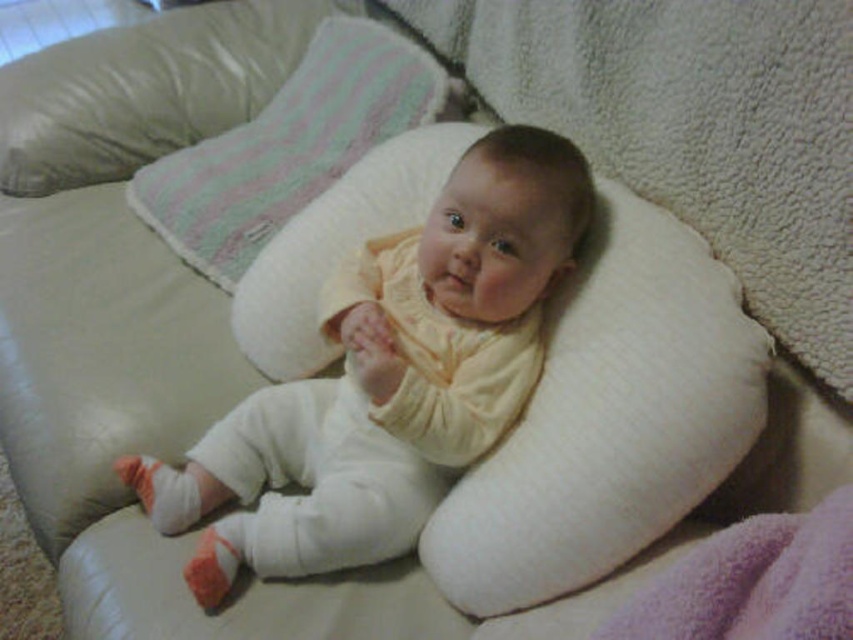
Question: Does white soft pillow at center lie behind purple soft blanket at lower right?

Choices:
 (A) yes
 (B) no

Answer: (A)

Question: Where is white fleece pillow at center located in relation to white soft pillow at center in the image?

Choices:
 (A) above
 (B) below

Answer: (A)

Question: Among these objects, which one is nearest to the camera?

Choices:
 (A) soft yellow fabric baby at center
 (B) white fleece pillow at center
 (C) purple soft blanket at lower right
 (D) white soft pillow at center

Answer: (C)

Question: Which of these objects is positioned closest to the white fleece pillow at center?

Choices:
 (A) soft yellow fabric baby at center
 (B) white soft pillow at center

Answer: (B)

Question: Which object is positioned farthest from the purple soft blanket at lower right?

Choices:
 (A) white soft pillow at upper center
 (B) white fleece pillow at center
 (C) soft yellow fabric baby at center

Answer: (A)

Question: Is soft yellow fabric baby at center closer to camera compared to white soft pillow at center?

Choices:
 (A) no
 (B) yes

Answer: (A)